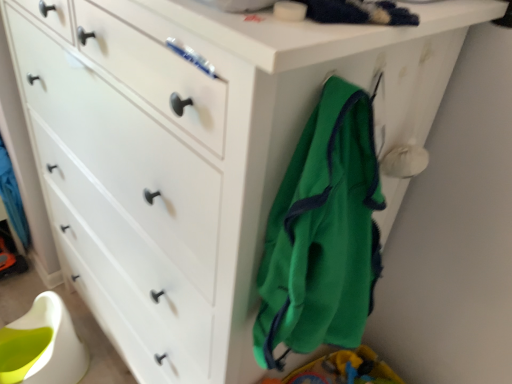
In the scene shown: Measure the distance between green plastic swivel chair at lower left and camera.

green plastic swivel chair at lower left is 4.18 feet from camera.

At what (x,y) coordinates should I click in order to perform the action: click on green plastic swivel chair at lower left. Please return your answer as a coordinate pair (x, y). Looking at the image, I should click on (42, 345).

What do you see at coordinates (42, 345) in the screenshot? Image resolution: width=512 pixels, height=384 pixels. I see `green plastic swivel chair at lower left` at bounding box center [42, 345].

The width and height of the screenshot is (512, 384). Identify the location of green plastic swivel chair at lower left. (42, 345).